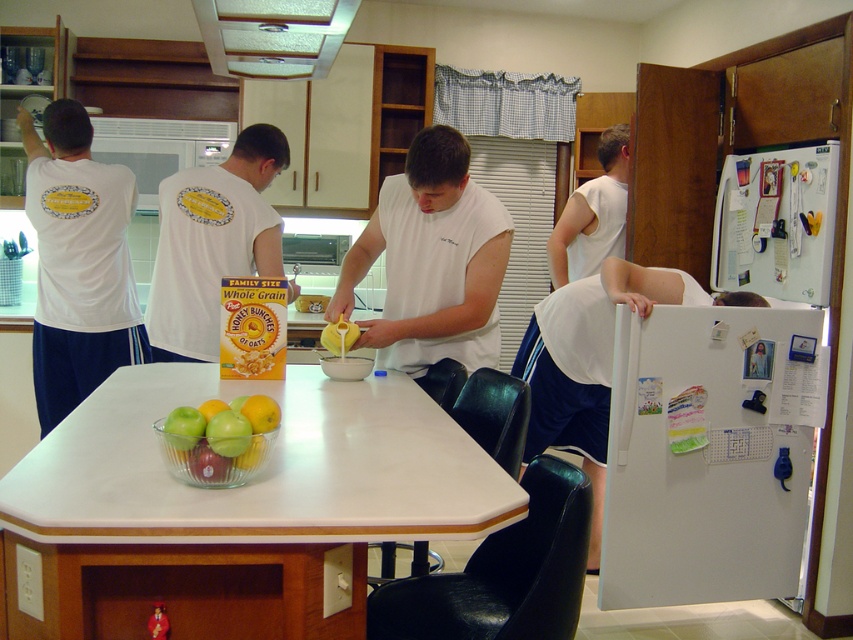
You are a chef standing in the kitchen and notice the white matte shirt at center and the yellow matte cereal bowl at center. Which object is taller?

The white matte shirt at center is much taller than the yellow matte cereal bowl at center.

You are a chef standing in the kitchen and need to access the yellow matte cereal bowl at center. However, the brushed metal exhaust hood at upper center is blocking your view. Can you move the exhaust hood to reach the bowl?

The brushed metal exhaust hood at upper center is in front of the yellow matte cereal bowl at center, meaning it is blocking direct access. However, since exhaust hoods are typically fixed installations, they cannot be moved easily. You may need to navigate around it or use a tool to reach the bowl without disturbing the hood.